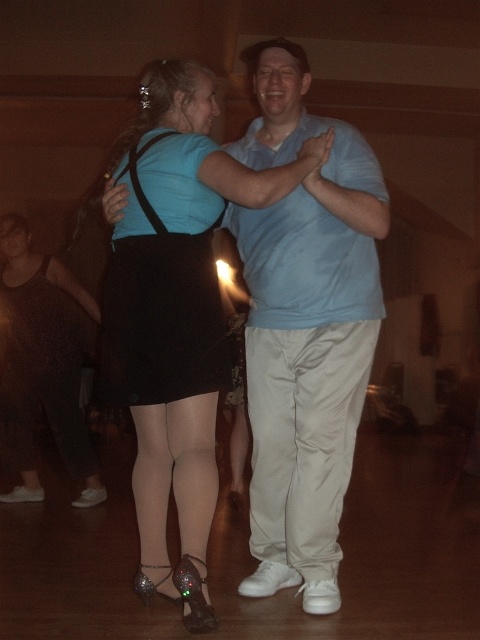
Question: Which point is closer to the camera?

Choices:
 (A) light blue cotton shirt at center
 (B) black satin skirt at center
 (C) matte black skirt at left
 (D) matte black skirt at center

Answer: (D)

Question: Does black satin skirt at center have a lesser width compared to matte black skirt at left?

Choices:
 (A) yes
 (B) no

Answer: (A)

Question: Where is matte black skirt at center located in relation to matte black skirt at left in the image?

Choices:
 (A) left
 (B) right

Answer: (B)

Question: Which object appears closest to the camera in this image?

Choices:
 (A) matte black skirt at center
 (B) matte black skirt at left

Answer: (A)

Question: Which point appears closest to the camera in this image?

Choices:
 (A) (25, 484)
 (B) (350, 225)
 (C) (211, 173)

Answer: (C)

Question: Can you confirm if light blue cotton shirt at center is positioned to the right of matte black skirt at center?

Choices:
 (A) yes
 (B) no

Answer: (A)